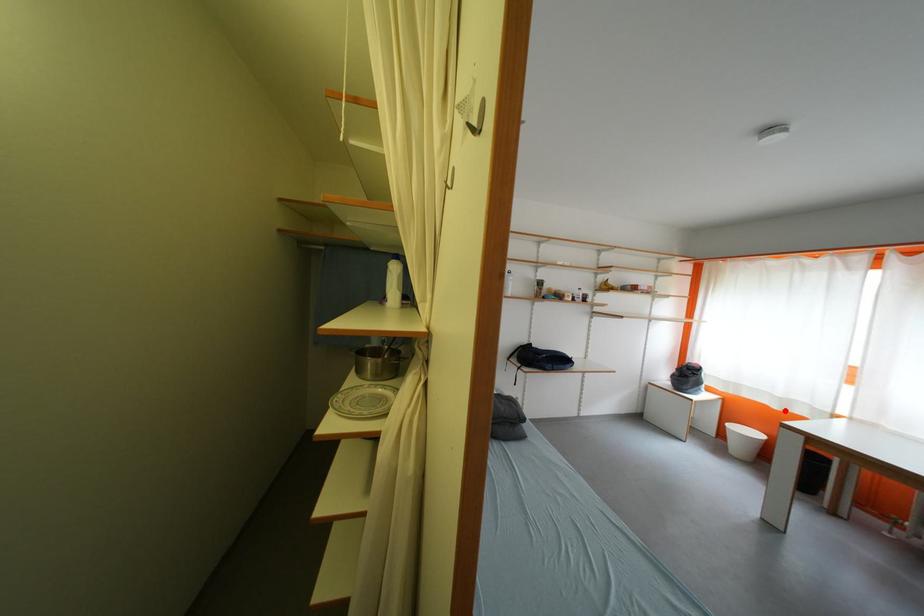
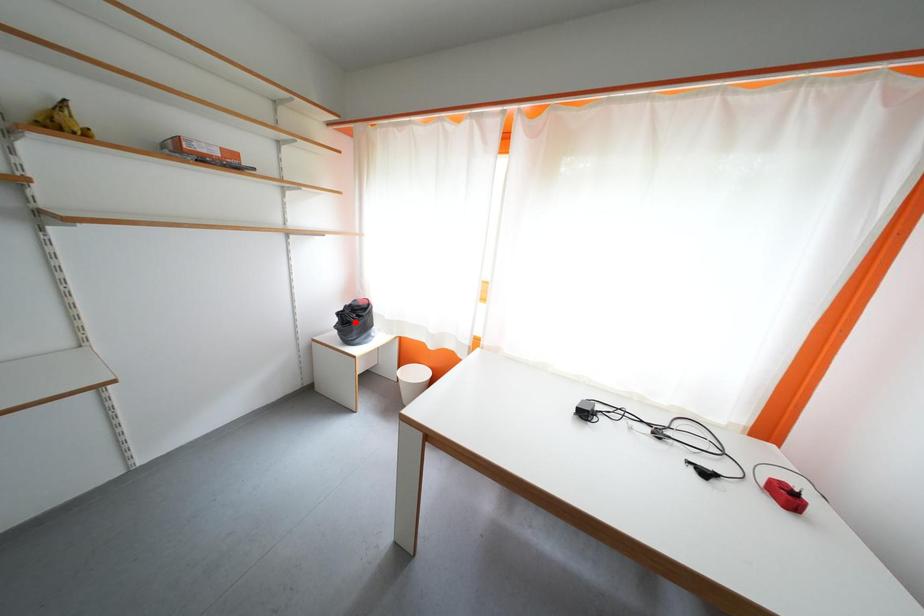
I am providing you with two images of the same scene from different viewpoints. A red point is marked on the first image and another point is marked on the second image. Is the red point in image1 aligned with the point shown in image2?

No